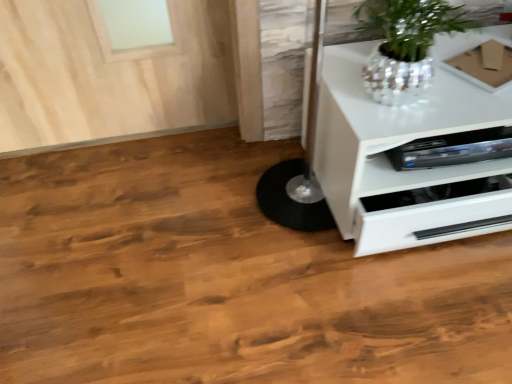
Where is `free space that is in between shiny metallic pot at upper right and brown cardboard box at upper right`? This screenshot has width=512, height=384. free space that is in between shiny metallic pot at upper right and brown cardboard box at upper right is located at coordinates (462, 88).